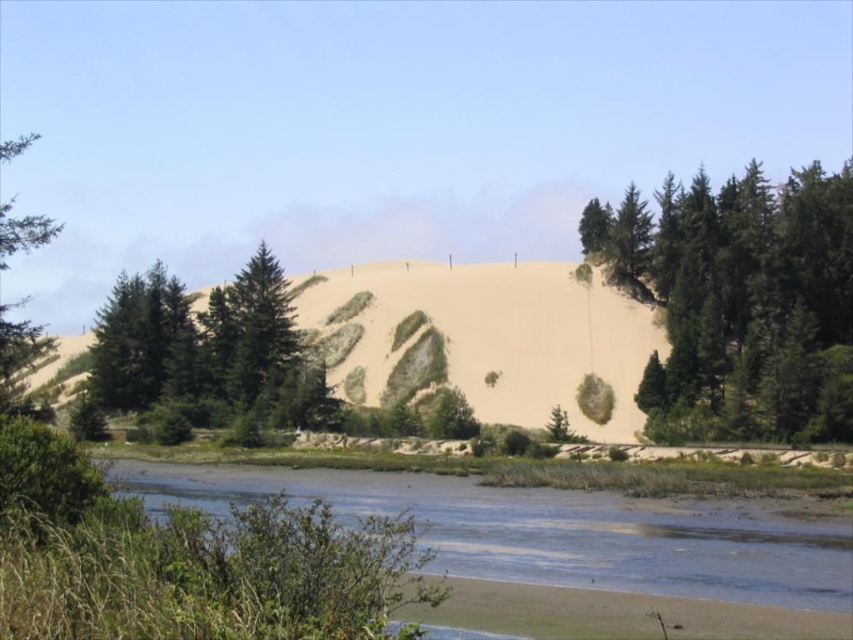
Can you confirm if green textured tree at upper right is bigger than green matte tree at left?

No, green textured tree at upper right is not bigger than green matte tree at left.

Can you confirm if green textured tree at upper right is wider than green matte tree at left?

In fact, green textured tree at upper right might be narrower than green matte tree at left.

Is point (706, 380) farther from camera compared to point (44, 224)?

Yes, point (706, 380) is farther from viewer.

Identify the location of green textured tree at upper right. (740, 301).

Which is more to the left, brown sandy river at lower center or sandy beige hillside at center?

brown sandy river at lower center is more to the left.

Which is behind, point (515, 579) or point (393, 355)?

The point (393, 355) is behind.

Which is behind, point (756, 586) or point (430, 289)?

Positioned behind is point (430, 289).

The image size is (853, 640). What are the coordinates of `brown sandy river at lower center` in the screenshot? It's located at (552, 531).

Find the location of a particular element. The image size is (853, 640). sandy beige hillside at center is located at coordinates (480, 339).

Between point (613, 355) and point (4, 244), which one is positioned behind?

Point (613, 355)

Which is in front, point (590, 285) or point (32, 221)?

Point (32, 221) is more forward.

Where is `sandy beige hillside at center`? This screenshot has width=853, height=640. sandy beige hillside at center is located at coordinates (480, 339).